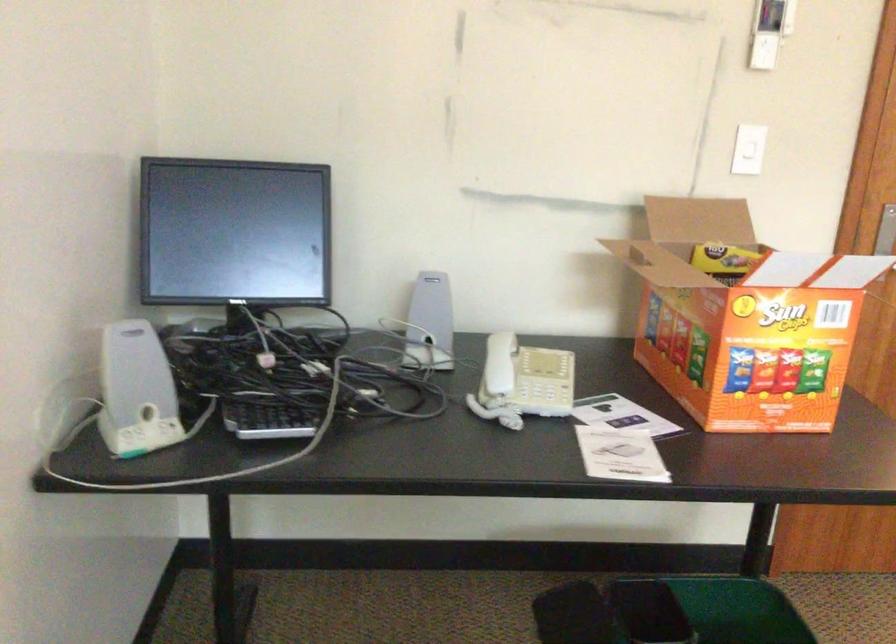
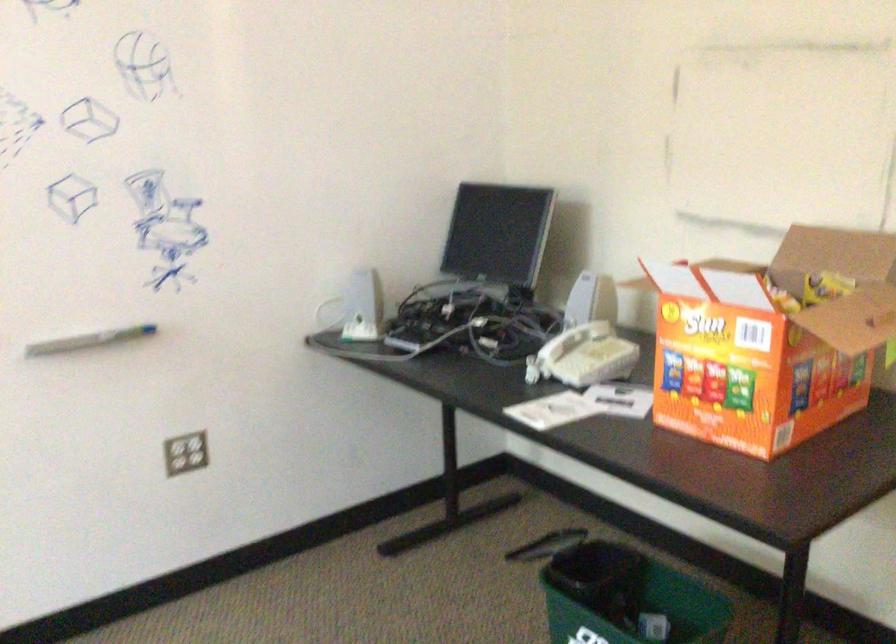
In the second image, find the point that corresponds to (x=436, y=317) in the first image.

(579, 305)